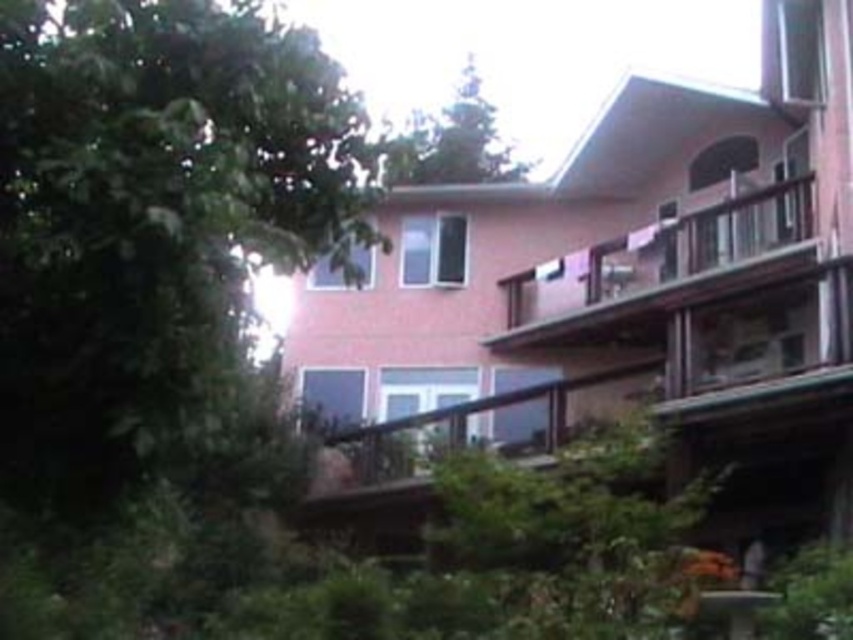
Question: Does brown wooden balcony at upper right appear under green leafy tree at upper center?

Choices:
 (A) yes
 (B) no

Answer: (A)

Question: Which of the following is the closest to the observer?

Choices:
 (A) (433, 163)
 (B) (683, 268)

Answer: (B)

Question: Which of the following is the farthest from the observer?

Choices:
 (A) (662, 268)
 (B) (445, 154)

Answer: (B)

Question: Among these points, which one is farthest from the camera?

Choices:
 (A) (434, 131)
 (B) (511, 294)

Answer: (A)

Question: Can you confirm if brown wooden balcony at upper right is wider than green leafy tree at upper center?

Choices:
 (A) no
 (B) yes

Answer: (A)

Question: Does brown wooden balcony at upper right come in front of green leafy tree at upper center?

Choices:
 (A) yes
 (B) no

Answer: (B)